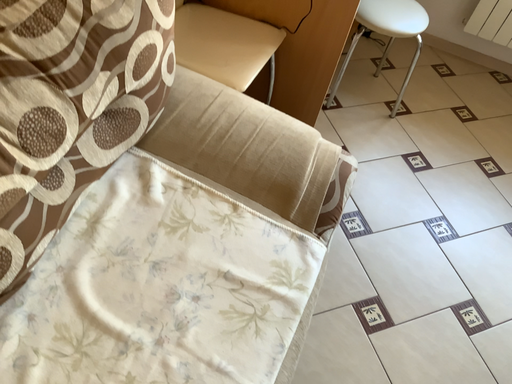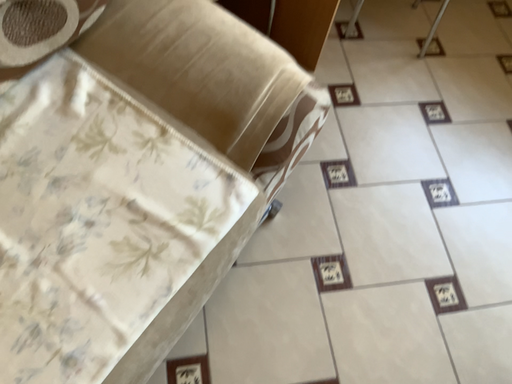
Question: How did the camera likely rotate when shooting the video?

Choices:
 (A) rotated right
 (B) rotated left

Answer: (B)